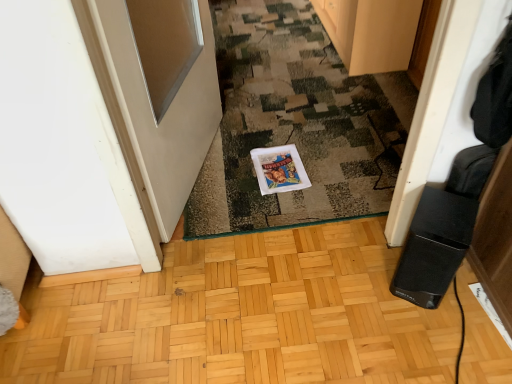
Question: Is point (270, 185) closer or farther from the camera than point (167, 213)?

Choices:
 (A) farther
 (B) closer

Answer: (A)

Question: Is white glossy postcard at center inside or outside of white glossy door at left?

Choices:
 (A) inside
 (B) outside

Answer: (B)

Question: Estimate the real-world distances between objects in this image. Which object is farther from the white glossy door at left?

Choices:
 (A) camouflage carpet at center
 (B) wooden cabinet at upper center
 (C) white glossy postcard at center
 (D) black plastic speaker at lower right

Answer: (B)

Question: Based on their relative distances, which object is nearer to the camouflage carpet at center?

Choices:
 (A) white glossy postcard at center
 (B) white glossy door at left
 (C) black plastic speaker at lower right
 (D) wooden cabinet at upper center

Answer: (A)